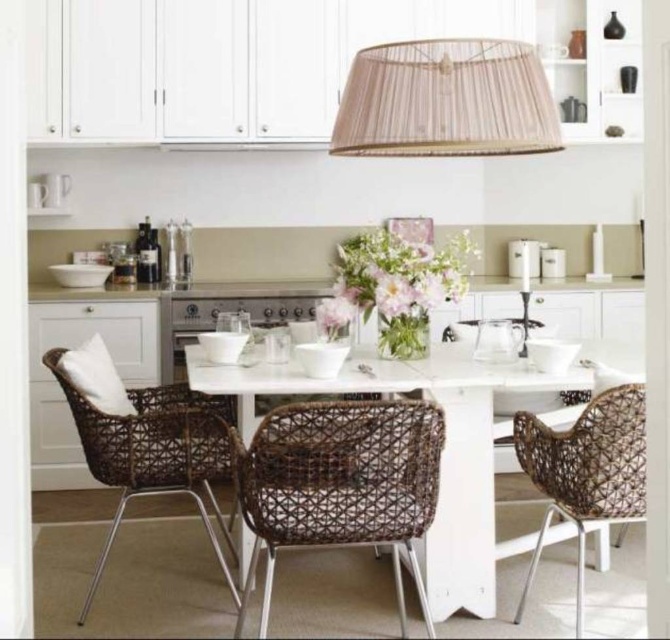
Question: Which point is farther to the camera?

Choices:
 (A) (371, 48)
 (B) (440, 516)
 (C) (210, 396)

Answer: (C)

Question: Is white matte table at center further to camera compared to brown woven chair at right?

Choices:
 (A) no
 (B) yes

Answer: (B)

Question: Is rattan chair at center to the left of brown woven chair at right from the viewer's perspective?

Choices:
 (A) no
 (B) yes

Answer: (B)

Question: Which point appears closest to the camera in this image?

Choices:
 (A) (470, 516)
 (B) (505, 113)
 (C) (127, 440)

Answer: (B)

Question: Is beige fabric lampshade at upper center in front of brown woven chair at right?

Choices:
 (A) yes
 (B) no

Answer: (B)

Question: Which of these objects is positioned farthest from the beige fabric lampshade at upper center?

Choices:
 (A) brown wicker chair at center
 (B) white matte table at center

Answer: (A)